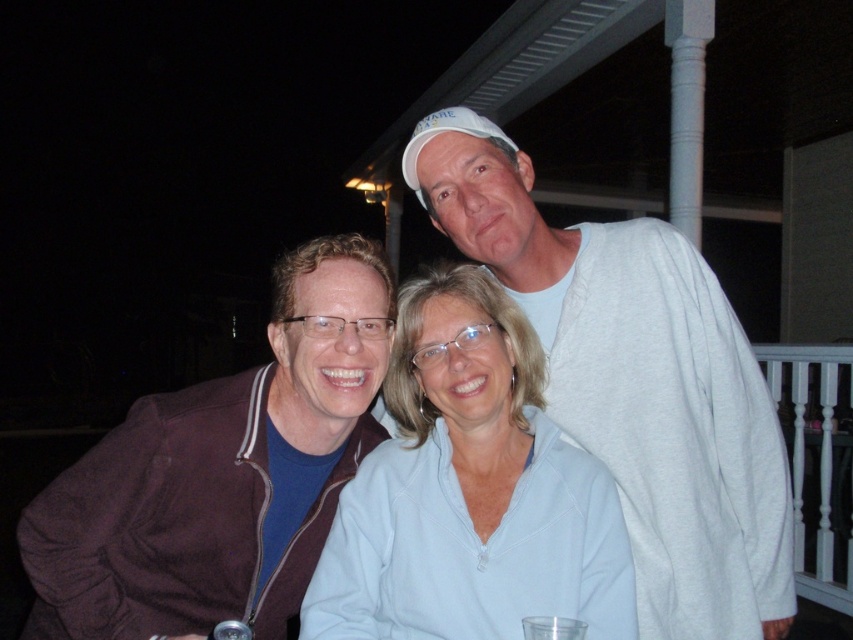
Question: Observing the image, what is the correct spatial positioning of white cotton shirt at upper right in reference to light blue zip-up sweater at center?

Choices:
 (A) right
 (B) left

Answer: (A)

Question: Is brown fabric jacket at left further to camera compared to light blue zip-up sweater at center?

Choices:
 (A) no
 (B) yes

Answer: (B)

Question: Which of these objects is positioned closest to the white cotton shirt at upper right?

Choices:
 (A) brown fabric jacket at left
 (B) light blue zip-up sweater at center

Answer: (B)

Question: Among these points, which one is farthest from the camera?

Choices:
 (A) (634, 365)
 (B) (210, 545)
 (C) (355, 636)

Answer: (A)

Question: Among these objects, which one is nearest to the camera?

Choices:
 (A) white cotton shirt at upper right
 (B) light blue zip-up sweater at center

Answer: (B)

Question: Is white cotton shirt at upper right smaller than brown fabric jacket at left?

Choices:
 (A) no
 (B) yes

Answer: (A)